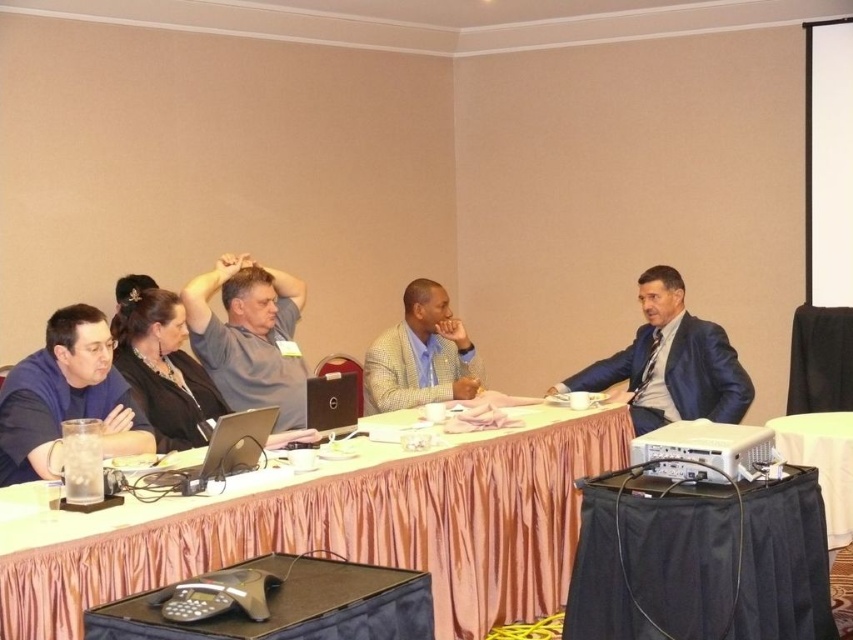
You are sitting at the black fabric table at lower right and want to reach the silver metallic laptop at center. Which direction should you move to get closer to it?

The silver metallic laptop at center is behind the black fabric table at lower right, so you should move forward to reach it.

You are organizing a small presentation and need to place a 12 inch wide projector next to the silver metallic laptop at center. Considering the space available on the black fabric table at lower right, will it fit?

The black fabric table at lower right has a larger size compared to the silver metallic laptop at center, so there should be enough space to place the 12 inch wide projector next to the laptop.

Looking at this image, you are a guest at a formal meeting and need to place your name tag on the table. The name tag is small and must be placed on the pink fabric table at center. However, there is a checkered fabric blazer at center on the table. Where should you place the name tag to ensure it is visible and not covered?

The pink fabric table at center is below the checkered fabric blazer at center, so you should place the name tag on the pink fabric table at center below the checkered fabric blazer at center to keep it visible and uncovered.